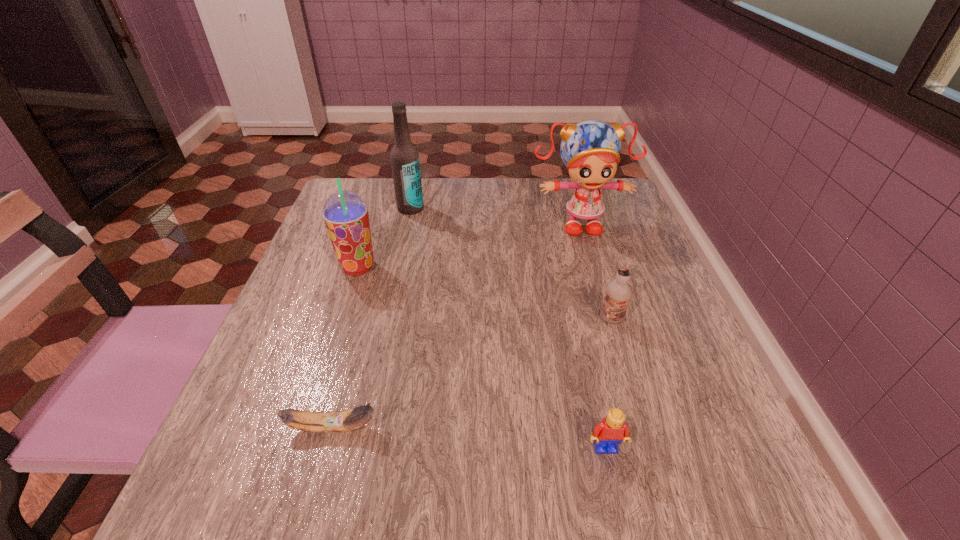
The width and height of the screenshot is (960, 540). What are the coordinates of `empty space between the fourth nearest object and the fourth farthest object` in the screenshot? It's located at (485, 293).

Where is `free spot between the nearest object and the fourth tallest object`? Image resolution: width=960 pixels, height=540 pixels. free spot between the nearest object and the fourth tallest object is located at coordinates (609, 383).

Where is `vacant area that lies between the doll and the Lego`? vacant area that lies between the doll and the Lego is located at coordinates (592, 335).

Where is `free area in between the fifth farthest object and the fourth tallest object`? This screenshot has height=540, width=960. free area in between the fifth farthest object and the fourth tallest object is located at coordinates (472, 373).

This screenshot has height=540, width=960. I want to click on vacant space that is in between the fourth shortest object and the doll, so click(468, 245).

Image resolution: width=960 pixels, height=540 pixels. Identify the location of free spot between the beer bottle and the chocolate milk. (511, 264).

The width and height of the screenshot is (960, 540). I want to click on free space that is in between the smoothie and the beer bottle, so click(x=384, y=238).

Locate an element on the screen. unoccupied position between the doll and the beer bottle is located at coordinates (494, 215).

At what (x,y) coordinates should I click in order to perform the action: click on empty location between the beer bottle and the chocolate milk. Please return your answer as a coordinate pair (x, y). The height and width of the screenshot is (540, 960). Looking at the image, I should click on (511, 264).

Locate which object ranks in proximity to the chocolate milk. Please provide its 2D coordinates. Your answer should be formatted as a tuple, i.e. [(x, y)], where the tuple contains the x and y coordinates of a point satisfying the conditions above.

[(608, 434)]